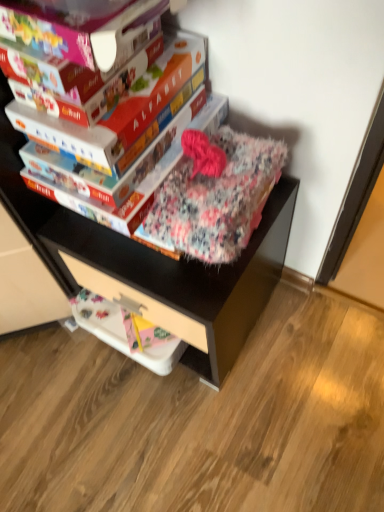
Where is `matte cardboard book at upper center, the 2th paperback book in the front-to-back sequence`? The width and height of the screenshot is (384, 512). matte cardboard book at upper center, the 2th paperback book in the front-to-back sequence is located at coordinates (67, 135).

What do you see at coordinates (67, 135) in the screenshot? The image size is (384, 512). I see `matte cardboard book at upper center, the second paperback book from the back` at bounding box center [67, 135].

This screenshot has width=384, height=512. What do you see at coordinates (145, 134) in the screenshot?
I see `matte cardboard book at center, the 3th paperback book in the front-to-back sequence` at bounding box center [145, 134].

Find the location of a particular element. This screenshot has width=384, height=512. matte cardboard book at upper left, positioned as the first paperback book in front-to-back order is located at coordinates (78, 27).

From the image's perspective, which object appears higher, white plastic drawer at lower center or fluffy floral blanket at center?

From the image's view, fluffy floral blanket at center is above.

Measure the distance between white plastic drawer at lower center and fluffy floral blanket at center.

white plastic drawer at lower center and fluffy floral blanket at center are 8.92 inches apart.

Looking at their sizes, would you say white plastic drawer at lower center is wider or thinner than fluffy floral blanket at center?

Clearly, white plastic drawer at lower center has more width compared to fluffy floral blanket at center.

From a real-world perspective, is white plastic drawer at lower center positioned above or below fluffy floral blanket at center?

white plastic drawer at lower center is situated lower than fluffy floral blanket at center in the real world.

From the image's perspective, is fluffy fabric bag at upper center above matte cardboard book at center, positioned as the 1th paperback book in back-to-front order?

No, from the image's perspective, fluffy fabric bag at upper center is not above matte cardboard book at center, positioned as the 1th paperback book in back-to-front order.

Based on the photo, is matte cardboard book at center, the 3th paperback book in the front-to-back sequence, at the back of fluffy fabric bag at upper center?

fluffy fabric bag at upper center does not have its back to matte cardboard book at center, the 3th paperback book in the front-to-back sequence.

From a real-world perspective, who is located higher, fluffy fabric bag at upper center or matte cardboard book at center, positioned as the 1th paperback book in back-to-front order?

From a 3D spatial view, matte cardboard book at center, positioned as the 1th paperback book in back-to-front order, is above.

In terms of height, does fluffy fabric bag at upper center look taller or shorter compared to matte cardboard book at center, positioned as the 1th paperback book in back-to-front order?

Considering their sizes, fluffy fabric bag at upper center has more height than matte cardboard book at center, positioned as the 1th paperback book in back-to-front order.

Does matte cardboard book at upper center, the 2th paperback book in the front-to-back sequence, have a greater height compared to fluffy floral blanket at center?

Incorrect, the height of matte cardboard book at upper center, the 2th paperback book in the front-to-back sequence, is not larger of that of fluffy floral blanket at center.

Between matte cardboard book at upper center, the second paperback book from the back, and fluffy floral blanket at center, which one appears on the right side from the viewer's perspective?

Positioned to the right is fluffy floral blanket at center.

Which of these two, matte cardboard book at upper center, the 2th paperback book in the front-to-back sequence, or fluffy floral blanket at center, is thinner?

Thinner between the two is fluffy floral blanket at center.

Considering the positions of objects fluffy floral blanket at center and matte cardboard book at center, the 3th paperback book in the front-to-back sequence, in the image provided, who is behind, fluffy floral blanket at center or matte cardboard book at center, the 3th paperback book in the front-to-back sequence,?

matte cardboard book at center, the 3th paperback book in the front-to-back sequence, is more distant.

Would you consider fluffy floral blanket at center to be distant from matte cardboard book at center, positioned as the 1th paperback book in back-to-front order?

That's not correct — fluffy floral blanket at center is a little close to matte cardboard book at center, positioned as the 1th paperback book in back-to-front order.

Is fluffy floral blanket at center taller or shorter than matte cardboard book at center, positioned as the 1th paperback book in back-to-front order?

fluffy floral blanket at center is taller than matte cardboard book at center, positioned as the 1th paperback book in back-to-front order.

Can you confirm if white plastic drawer at lower center is smaller than matte cardboard book at upper left, the third paperback book when ordered from back to front?

Correct, white plastic drawer at lower center occupies less space than matte cardboard book at upper left, the third paperback book when ordered from back to front.

In the scene shown: From a real-world perspective, does white plastic drawer at lower center sit lower than matte cardboard book at upper left, the third paperback book when ordered from back to front?

Yes.

In the scene shown: Which object is closer to the camera, white plastic drawer at lower center or matte cardboard book at upper left, positioned as the first paperback book in front-to-back order?

matte cardboard book at upper left, positioned as the first paperback book in front-to-back order, is more forward.

How far apart are matte cardboard book at center, positioned as the 1th paperback book in back-to-front order, and fluffy floral blanket at center?

The distance of matte cardboard book at center, positioned as the 1th paperback book in back-to-front order, from fluffy floral blanket at center is 3.76 inches.

Considering the relative sizes of matte cardboard book at center, the 3th paperback book in the front-to-back sequence, and fluffy floral blanket at center in the image provided, is matte cardboard book at center, the 3th paperback book in the front-to-back sequence, bigger than fluffy floral blanket at center?

Actually, matte cardboard book at center, the 3th paperback book in the front-to-back sequence, might be smaller than fluffy floral blanket at center.

Considering the relative sizes of matte cardboard book at center, positioned as the 1th paperback book in back-to-front order, and fluffy floral blanket at center in the image provided, is matte cardboard book at center, positioned as the 1th paperback book in back-to-front order, thinner than fluffy floral blanket at center?

No, matte cardboard book at center, positioned as the 1th paperback book in back-to-front order, is not thinner than fluffy floral blanket at center.

From the image's perspective, would you say fluffy floral blanket at center is shown under matte cardboard book at upper center, the second paperback book from the back?

Yes, from the image's perspective, fluffy floral blanket at center is below matte cardboard book at upper center, the second paperback book from the back.

From the image's perspective, which paperback book is the 2nd one above the fluffy floral blanket at center? Please provide its 2D coordinates.

[(67, 135)]

Does fluffy floral blanket at center have a greater width compared to matte cardboard book at upper center, the second paperback book from the back?

In fact, fluffy floral blanket at center might be narrower than matte cardboard book at upper center, the second paperback book from the back.

Considering the points (196, 213) and (44, 129), which point is in front, point (196, 213) or point (44, 129)?

The point (44, 129) is closer to the camera.

Identify the location of bedding that is above the white plastic drawer at lower center (from the image's perspective). (215, 194).

This screenshot has height=512, width=384. What are the coordinates of `paperback book that is the 1st one when counting leftward from the fluffy fabric bag at upper center` in the screenshot? It's located at (145, 134).

From the image, which object appears to be nearer to matte cardboard book at center, positioned as the 1th paperback book in back-to-front order, fluffy floral blanket at center or white plastic drawer at lower center?

Based on the image, fluffy floral blanket at center appears to be nearer to matte cardboard book at center, positioned as the 1th paperback book in back-to-front order.

Estimate the real-world distances between objects in this image. Which object is closer to matte cardboard book at upper left, the third paperback book when ordered from back to front, matte cardboard book at center, positioned as the 1th paperback book in back-to-front order, or matte cardboard book at upper center, the second paperback book from the back?

Among the two, matte cardboard book at upper center, the second paperback book from the back, is located nearer to matte cardboard book at upper left, the third paperback book when ordered from back to front.

Considering their positions, is matte cardboard book at center, positioned as the 1th paperback book in back-to-front order, positioned closer to matte cardboard book at upper center, the 2th paperback book in the front-to-back sequence, than matte cardboard book at upper left, positioned as the first paperback book in front-to-back order?

matte cardboard book at center, positioned as the 1th paperback book in back-to-front order.

Considering their positions, is fluffy floral blanket at center positioned closer to fluffy fabric bag at upper center than matte cardboard book at upper left, the third paperback book when ordered from back to front?

fluffy floral blanket at center is positioned closer to the anchor fluffy fabric bag at upper center.

When comparing their distances from fluffy fabric bag at upper center, does matte cardboard book at upper left, positioned as the first paperback book in front-to-back order, or matte cardboard book at center, positioned as the 1th paperback book in back-to-front order, seem further?

matte cardboard book at upper left, positioned as the first paperback book in front-to-back order, lies further to fluffy fabric bag at upper center than the other object.

Estimate the real-world distances between objects in this image. Which object is further from fluffy floral blanket at center, matte cardboard book at center, positioned as the 1th paperback book in back-to-front order, or white plastic drawer at lower center?

white plastic drawer at lower center.

Looking at the image, which one is located further to matte cardboard book at center, the 3th paperback book in the front-to-back sequence, matte cardboard book at upper center, the 2th paperback book in the front-to-back sequence, or fluffy floral blanket at center?

The object further to matte cardboard book at center, the 3th paperback book in the front-to-back sequence, is fluffy floral blanket at center.

When comparing their distances from matte cardboard book at upper center, the second paperback book from the back, does matte cardboard book at upper left, positioned as the first paperback book in front-to-back order, or fluffy fabric bag at upper center seem closer?

The object closer to matte cardboard book at upper center, the second paperback book from the back, is matte cardboard book at upper left, positioned as the first paperback book in front-to-back order.

Image resolution: width=384 pixels, height=512 pixels. I want to click on computer desk that lies between matte cardboard book at upper center, the 2th paperback book in the front-to-back sequence, and white plastic drawer at lower center from top to bottom, so tap(180, 279).

Find the location of a particular element. computer desk between matte cardboard book at upper left, the third paperback book when ordered from back to front, and white plastic drawer at lower center, in the vertical direction is located at coordinates (180, 279).

The width and height of the screenshot is (384, 512). In order to click on bedding between matte cardboard book at upper center, the 2th paperback book in the front-to-back sequence, and white plastic drawer at lower center, in the vertical direction in this screenshot , I will do point(215,194).

Identify the location of bedding between matte cardboard book at upper left, the third paperback book when ordered from back to front, and fluffy fabric bag at upper center from top to bottom. This screenshot has height=512, width=384. tap(215, 194).